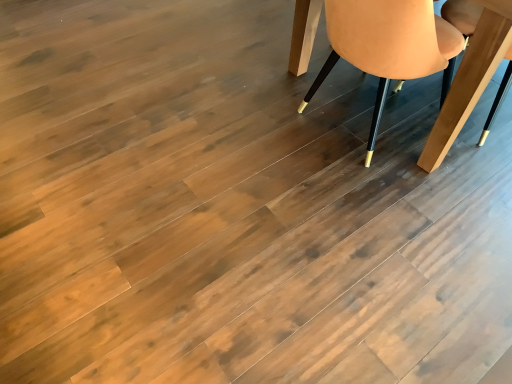
Image resolution: width=512 pixels, height=384 pixels. What do you see at coordinates (387, 45) in the screenshot?
I see `suede-like beige chair at upper right` at bounding box center [387, 45].

I want to click on suede-like beige chair at upper right, so click(x=387, y=45).

At what (x,y) coordinates should I click in order to perform the action: click on suede-like beige chair at upper right. Please return your answer as a coordinate pair (x, y). The height and width of the screenshot is (384, 512). Looking at the image, I should click on (387, 45).